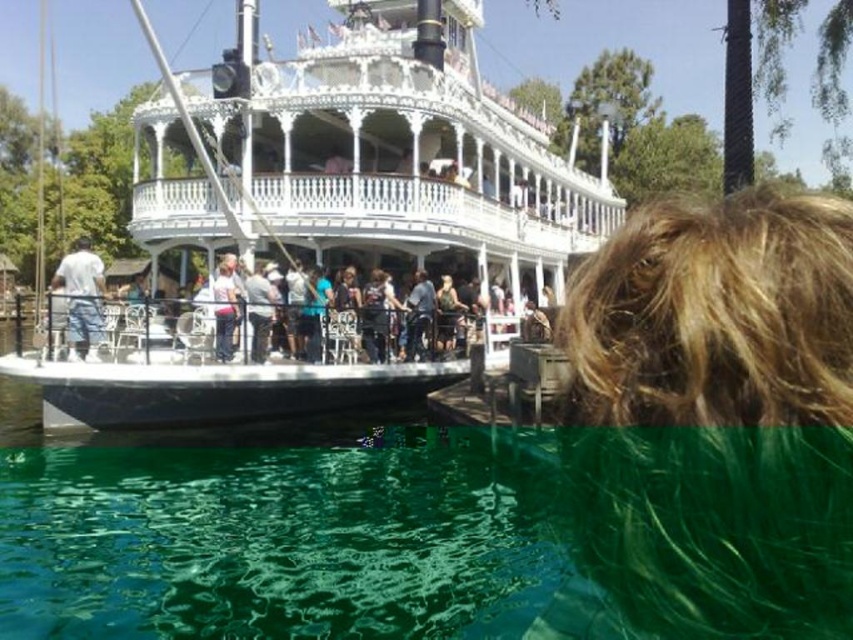
Does blonde hair at upper right appear on the left side of white cotton shirt at left?

Incorrect, blonde hair at upper right is not on the left side of white cotton shirt at left.

Who is positioned more to the left, blonde hair at upper right or white cotton shirt at left?

white cotton shirt at left is more to the left.

I want to click on blonde hair at upper right, so click(717, 417).

Is white wooden boat at center to the right of white cotton shirt at left from the viewer's perspective?

Indeed, white wooden boat at center is positioned on the right side of white cotton shirt at left.

Does white wooden boat at center lie in front of white cotton shirt at left?

Yes, white wooden boat at center is closer to the viewer.

Who is more distant from viewer, (252, 120) or (96, 291)?

Point (252, 120)

You are a GUI agent. You are given a task and a screenshot of the screen. Output one action in this format:
    pyautogui.click(x=<x>, y=<y>)
    Task: Click on the white wooden boat at center
    
    Given the screenshot: What is the action you would take?
    pyautogui.click(x=372, y=164)

Consider the image. Which is above, white wooden boat at center or blonde hair at upper right?

Positioned higher is white wooden boat at center.

You are a GUI agent. You are given a task and a screenshot of the screen. Output one action in this format:
    pyautogui.click(x=<x>, y=<y>)
    Task: Click on the white wooden boat at center
    Image resolution: width=853 pixels, height=640 pixels.
    Given the screenshot: What is the action you would take?
    pyautogui.click(x=372, y=164)